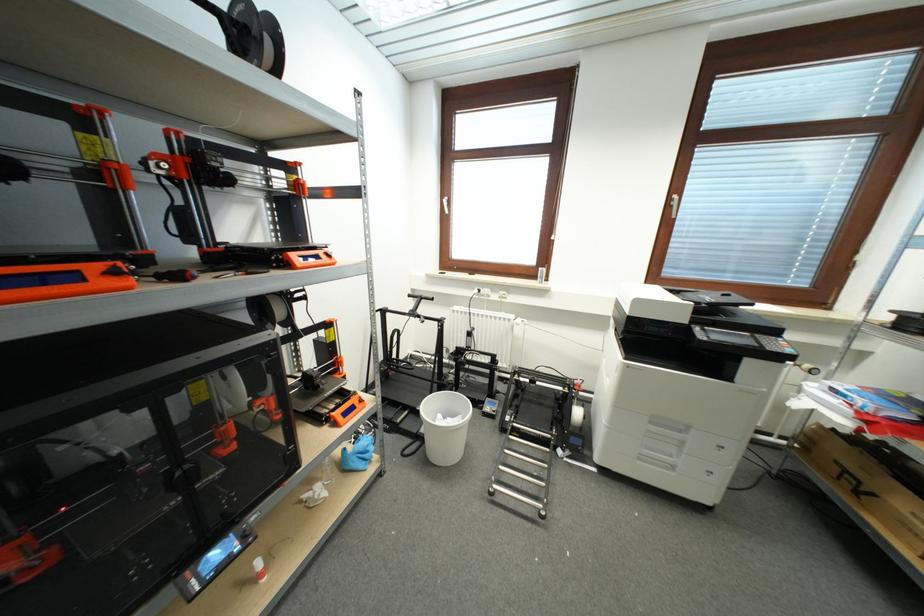
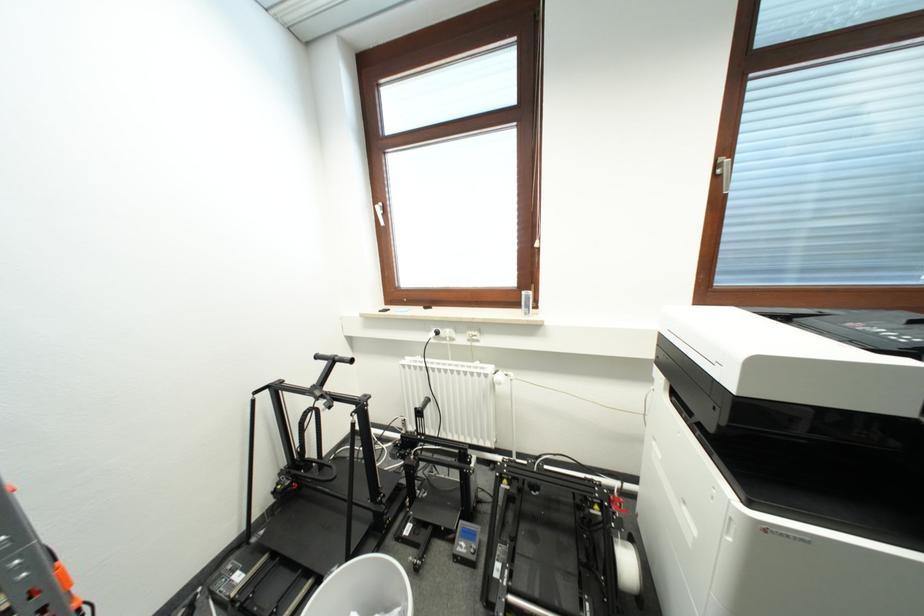
The point at (708, 156) is marked in the first image. Where is the corresponding point in the second image?

(766, 89)